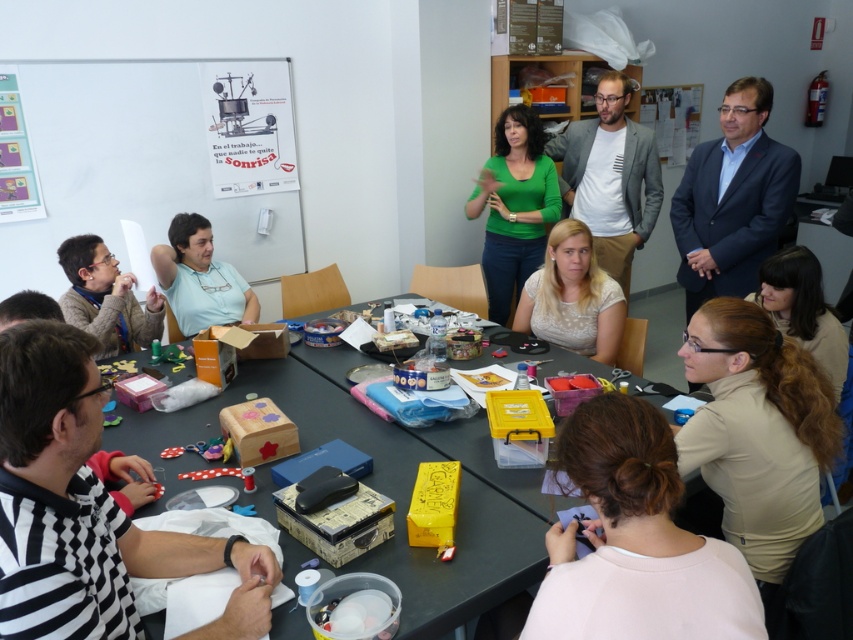
Question: Which point is farther from the camera taking this photo?

Choices:
 (A) (323, 369)
 (B) (138, 200)
 (C) (776, 577)

Answer: (B)

Question: Which point is farther to the camera?

Choices:
 (A) black checkered shirt at lower left
 (B) white cotton shirt at center
 (C) green matte shirt at center
 (D) wooden table at center

Answer: (C)

Question: Does blue suit jacket at upper right have a greater width compared to white lace blouse at center?

Choices:
 (A) yes
 (B) no

Answer: (A)

Question: Does black checkered shirt at lower left appear under white cotton shirt at center?

Choices:
 (A) yes
 (B) no

Answer: (A)

Question: Which object is farther from the camera taking this photo?

Choices:
 (A) wooden table at center
 (B) white lace blouse at center
 (C) green matte shirt at center

Answer: (C)

Question: Can you confirm if white paperboard at upper left is smaller than matte black glasses at left?

Choices:
 (A) yes
 (B) no

Answer: (B)